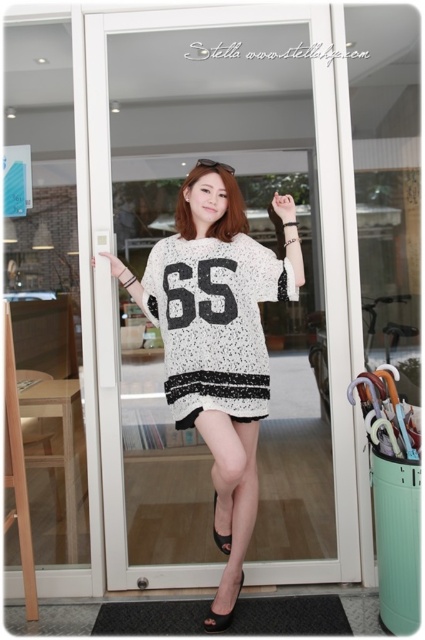
Question: Which object appears farthest from the camera in this image?

Choices:
 (A) white textured sweater at center
 (B) black leather sandal at lower center
 (C) white dotted jersey at center

Answer: (B)

Question: From the image, what is the correct spatial relationship of white textured sweater at center in relation to black leather sandal at lower center?

Choices:
 (A) below
 (B) above

Answer: (B)

Question: Estimate the real-world distances between objects in this image. Which object is closer to the white dotted jersey at center?

Choices:
 (A) black leather sandal at lower center
 (B) black suede sandal at lower center

Answer: (A)

Question: Is white textured sweater at center further to the viewer compared to white dotted jersey at center?

Choices:
 (A) no
 (B) yes

Answer: (A)

Question: Among these points, which one is farthest from the camera?

Choices:
 (A) (227, 621)
 (B) (288, 230)
 (C) (173, 384)
 (D) (214, 497)

Answer: (D)

Question: Observing the image, what is the correct spatial positioning of black suede sandal at lower center in reference to black leather sandal at lower center?

Choices:
 (A) below
 (B) above

Answer: (A)